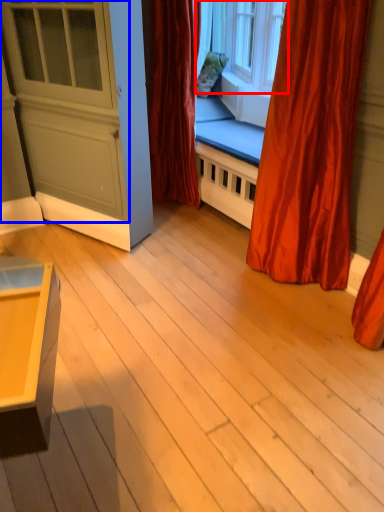
Question: Among these objects, which one is nearest to the camera, window (highlighted by a red box) or screen door (highlighted by a blue box)?

Choices:
 (A) window
 (B) screen door

Answer: (B)